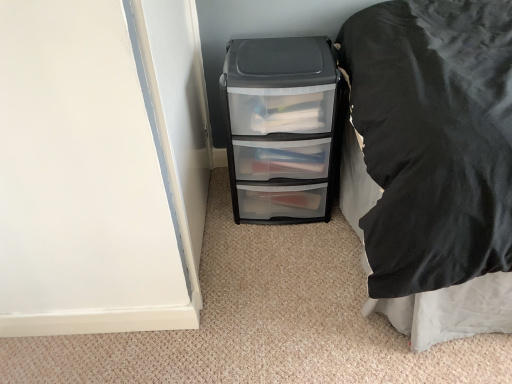
Question: Can you confirm if clear plastic drawer unit at lower right is shorter than transparent plastic file cabinet at center?

Choices:
 (A) yes
 (B) no

Answer: (B)

Question: Is clear plastic drawer unit at lower right to the right of transparent plastic file cabinet at center from the viewer's perspective?

Choices:
 (A) yes
 (B) no

Answer: (A)

Question: From a real-world perspective, is clear plastic drawer unit at lower right positioned under transparent plastic file cabinet at center based on gravity?

Choices:
 (A) yes
 (B) no

Answer: (B)

Question: Is transparent plastic file cabinet at center completely or partially inside clear plastic drawer unit at lower right?

Choices:
 (A) no
 (B) yes

Answer: (A)

Question: From the image's perspective, is clear plastic drawer unit at lower right located above transparent plastic file cabinet at center?

Choices:
 (A) no
 (B) yes

Answer: (A)

Question: Considering the relative sizes of clear plastic drawer unit at lower right and transparent plastic file cabinet at center in the image provided, is clear plastic drawer unit at lower right smaller than transparent plastic file cabinet at center?

Choices:
 (A) yes
 (B) no

Answer: (B)

Question: From a real-world perspective, is transparent plastic file cabinet at center located beneath clear plastic drawer unit at lower right?

Choices:
 (A) yes
 (B) no

Answer: (A)

Question: Is transparent plastic file cabinet at center wider than clear plastic drawer unit at lower right?

Choices:
 (A) yes
 (B) no

Answer: (B)

Question: Is transparent plastic file cabinet at center far from clear plastic drawer unit at lower right?

Choices:
 (A) no
 (B) yes

Answer: (A)

Question: From the image's perspective, does transparent plastic file cabinet at center appear higher than clear plastic drawer unit at lower right?

Choices:
 (A) no
 (B) yes

Answer: (B)

Question: Are transparent plastic file cabinet at center and clear plastic drawer unit at lower right beside each other?

Choices:
 (A) no
 (B) yes

Answer: (A)

Question: Is transparent plastic file cabinet at center smaller than clear plastic drawer unit at lower right?

Choices:
 (A) no
 (B) yes

Answer: (B)

Question: Looking at their shapes, would you say clear plastic drawer unit at lower right is wider or thinner than transparent plastic file cabinet at center?

Choices:
 (A) thin
 (B) wide

Answer: (B)